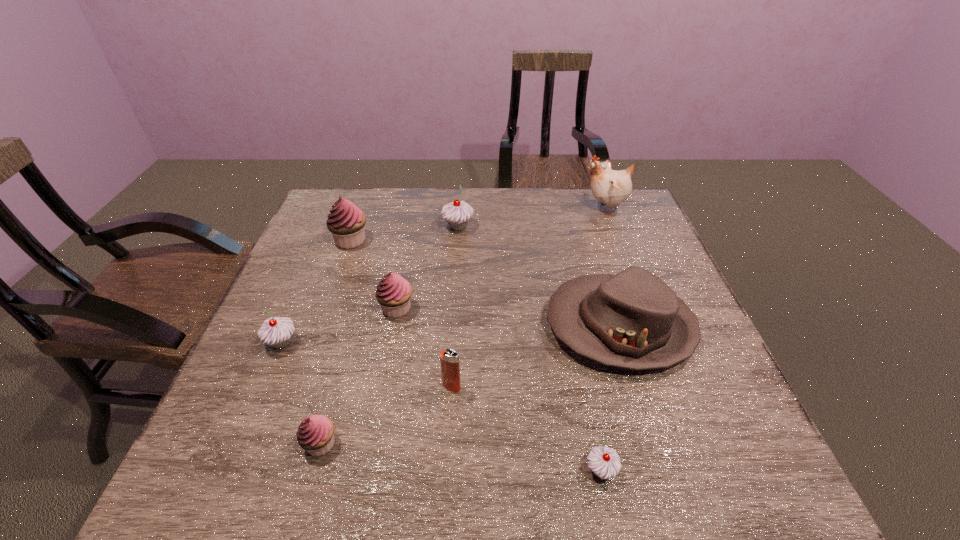
The image size is (960, 540). In order to click on vacant space that is in between the tallest object and the rightmost pink cupcake in this screenshot , I will do `click(501, 258)`.

Where is `empty location between the third cupcake from right to left and the seventh farthest object`? The image size is (960, 540). empty location between the third cupcake from right to left and the seventh farthest object is located at coordinates (424, 347).

Locate an element on the screen. This screenshot has height=540, width=960. vacant space that is in between the second nearest gray cupcake and the biggest gray cupcake is located at coordinates pyautogui.click(x=370, y=285).

You are a GUI agent. You are given a task and a screenshot of the screen. Output one action in this format:
    pyautogui.click(x=<x>, y=<y>)
    Task: Click on the unoccupied position between the tallest object and the nearest pink cupcake
    
    Given the screenshot: What is the action you would take?
    click(x=463, y=326)

Find the location of a particular element. the eighth closest object relative to the fourth farthest cupcake is located at coordinates (611, 187).

Select which object appears as the eighth closest to the third nearest object. Please provide its 2D coordinates. Your answer should be formatted as a tuple, i.e. [(x, y)], where the tuple contains the x and y coordinates of a point satisfying the conditions above.

[(611, 187)]

Choose which cupcake is the second nearest neighbor to the hat. Please provide its 2D coordinates. Your answer should be formatted as a tuple, i.e. [(x, y)], where the tuple contains the x and y coordinates of a point satisfying the conditions above.

[(458, 213)]

Locate an element on the screen. The image size is (960, 540). cupcake object that ranks as the fifth closest to the smallest pink cupcake is located at coordinates (458, 213).

Locate an element on the screen. the closest gray cupcake relative to the farthest pink cupcake is located at coordinates (458, 213).

Select which gray cupcake appears as the closest to the biggest pink cupcake. Please provide its 2D coordinates. Your answer should be formatted as a tuple, i.e. [(x, y)], where the tuple contains the x and y coordinates of a point satisfying the conditions above.

[(458, 213)]